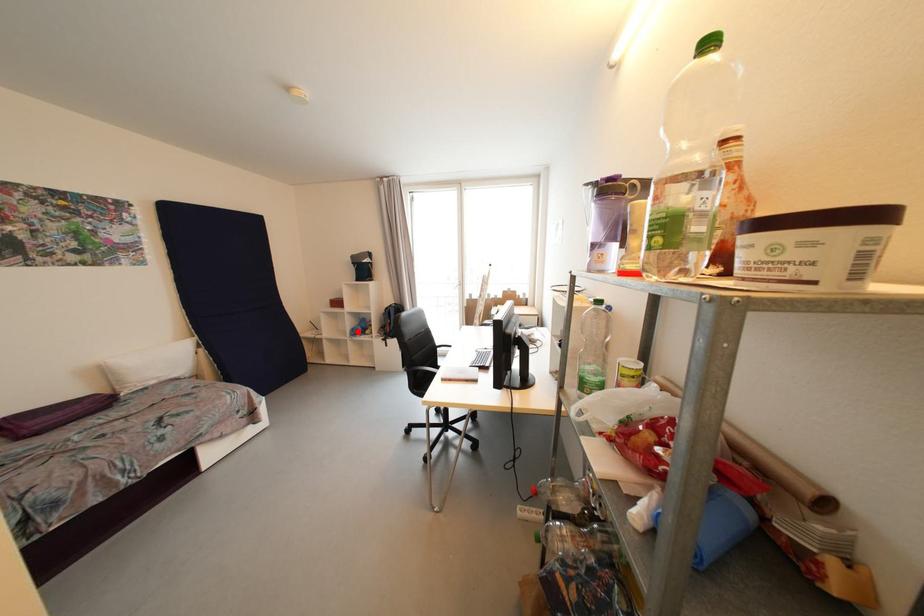
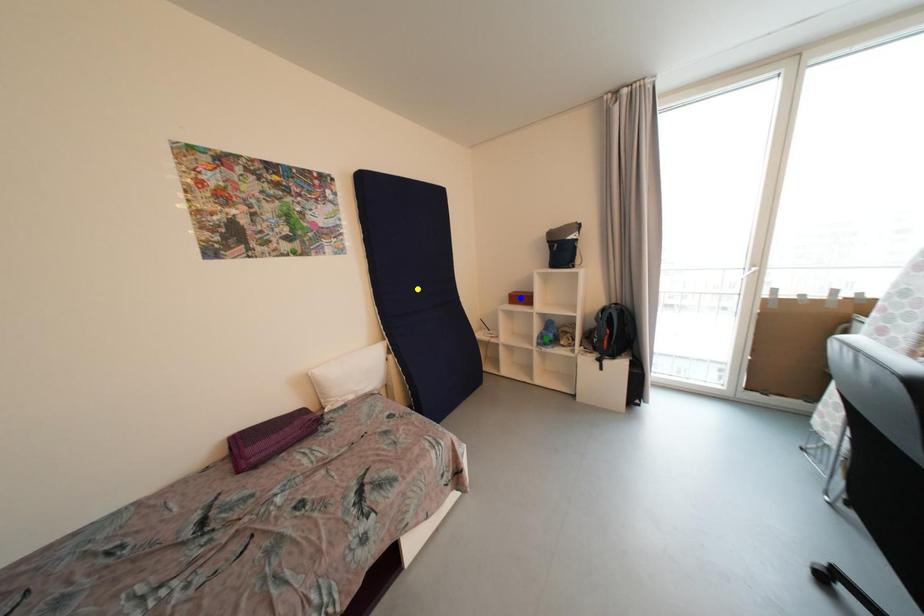
Question: I am providing you with two images of the same scene from different viewpoints. A red point is marked on the first image. You are given multiple points on the second image. Can you choose the point in image 2 that corresponds to the point in image 1?

Choices:
 (A) blue point
 (B) yellow point
 (C) green point

Answer: (C)